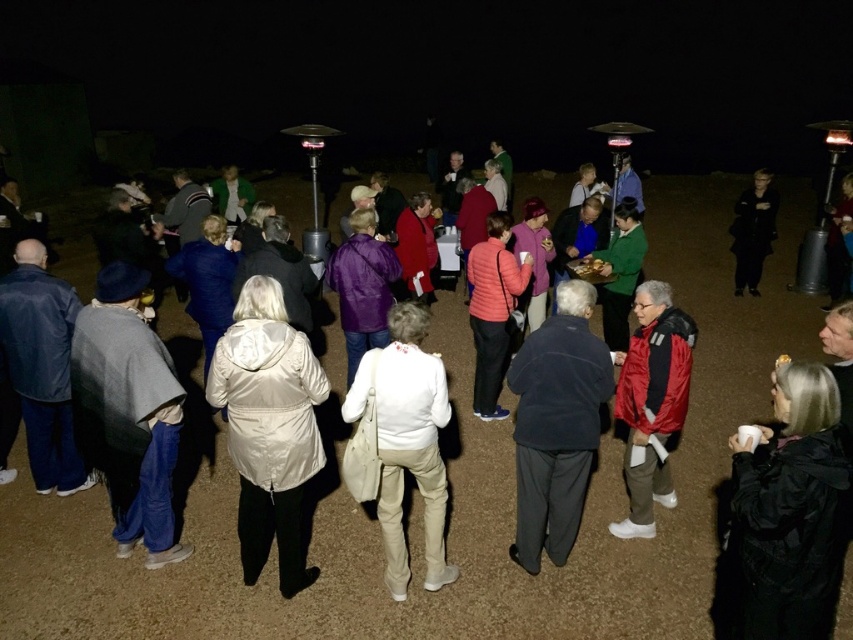
You are organizing a photo shoot and need to arrange two jackets, the dark blue fleece jacket at center and the red matte jacket at center, on a mannequin. Which jacket should you place first if you want the wider jacket to be on the left side?

The dark blue fleece jacket at center is wider than the red matte jacket at center, so you should place the dark blue fleece jacket at center first on the left side.

You are a photographer standing at the edge of the gathering. You need to capture a photo of the white glossy coat at center. Where should you aim your camera to ensure the coat is in the frame?

You should aim your camera at point [270,428] to capture the white glossy coat at center, as that is its exact location.